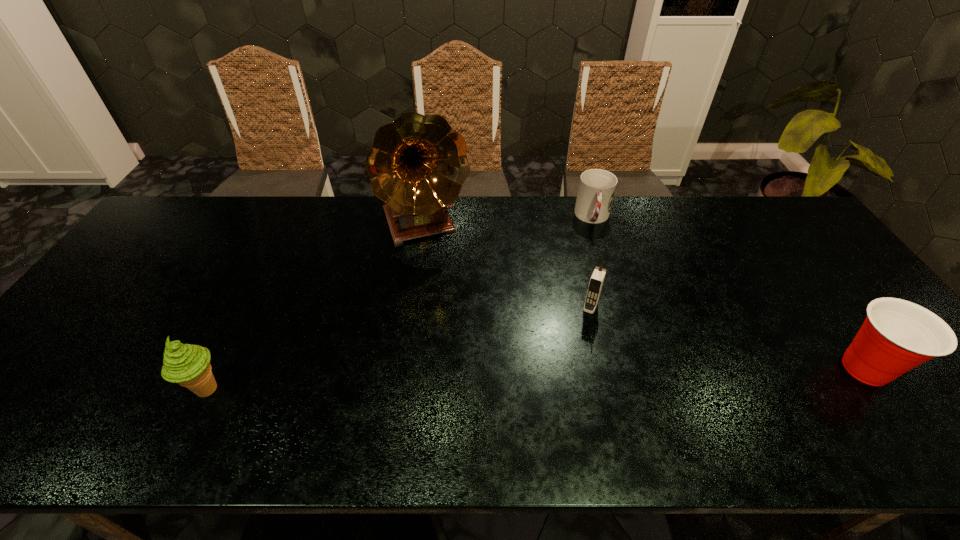
Where is `the closest object to the tallest object`? the closest object to the tallest object is located at coordinates (597, 187).

The width and height of the screenshot is (960, 540). I want to click on object that ranks as the closest to the left cup, so click(x=596, y=282).

Where is `vacant point that satisfies the following two spatial constraints: 1. on the back side of the cellular telephone; 2. on the left side of the leftmost object`? Image resolution: width=960 pixels, height=540 pixels. vacant point that satisfies the following two spatial constraints: 1. on the back side of the cellular telephone; 2. on the left side of the leftmost object is located at coordinates (249, 307).

Image resolution: width=960 pixels, height=540 pixels. I want to click on vacant point that satisfies the following two spatial constraints: 1. on the back side of the second object from left to right; 2. on the right side of the left cup, so click(x=426, y=218).